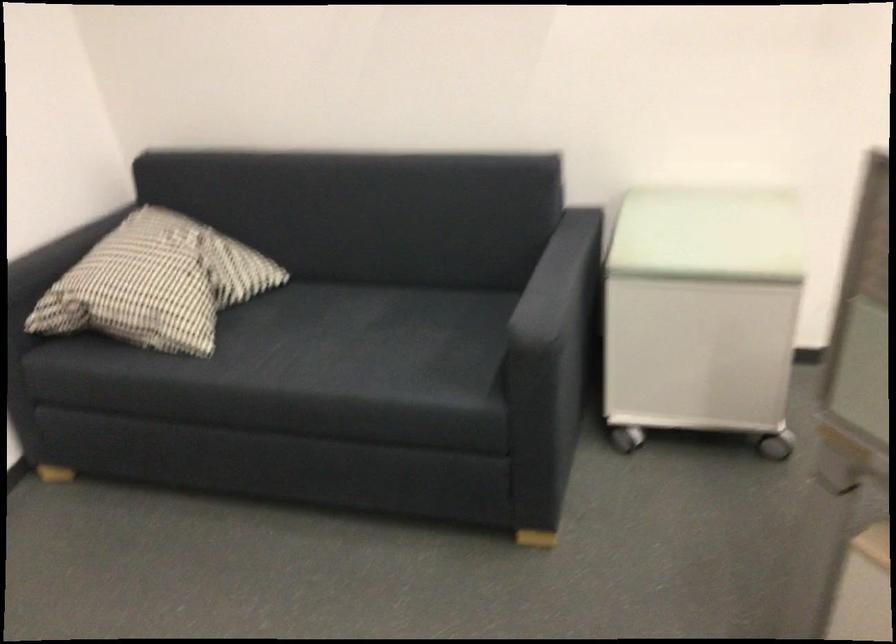
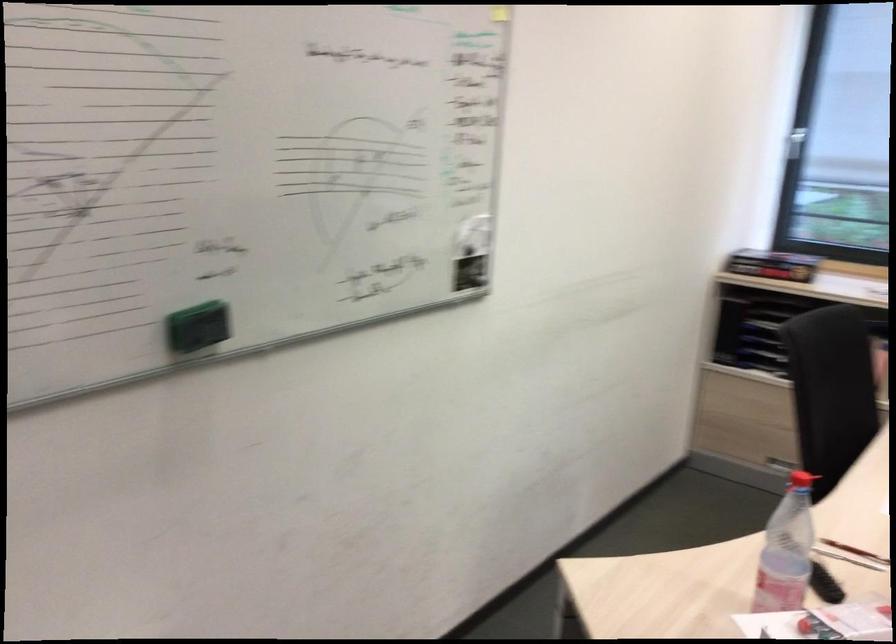
Question: Based on the continuous images, in which direction is the camera rotating? Reply with the corresponding letter.

Choices:
 (A) Left
 (B) Right
 (C) Up
 (D) Down

Answer: (B)